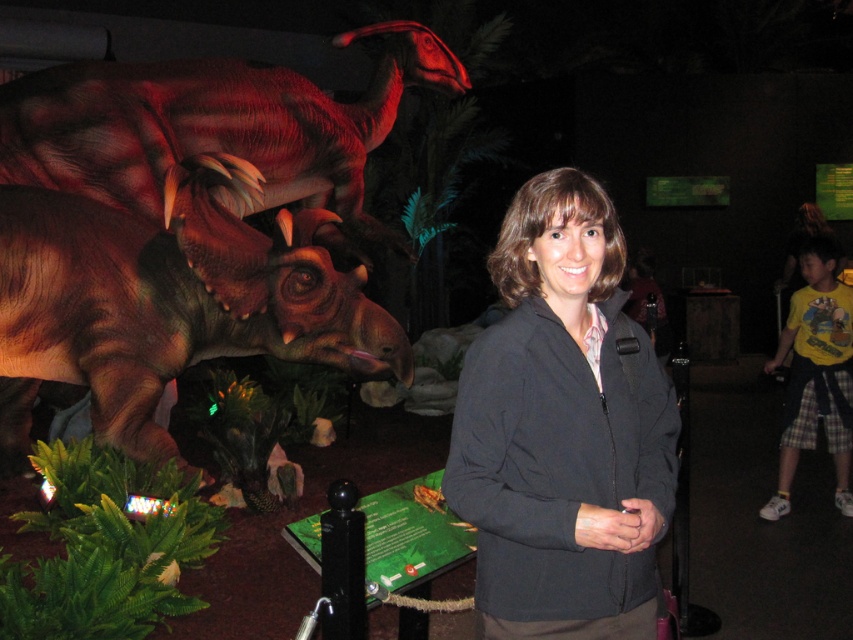
Question: Is brown matte/dull triceratops at left bigger than shiny brown dinosaur at upper left?

Choices:
 (A) no
 (B) yes

Answer: (A)

Question: Among these objects, which one is nearest to the camera?

Choices:
 (A) brown matte/dull triceratops at left
 (B) black fabric jacket at center
 (C) yellow printed t-shirt at right

Answer: (B)

Question: Which of the following is the closest to the observer?

Choices:
 (A) brown matte/dull triceratops at left
 (B) yellow printed t-shirt at right

Answer: (A)

Question: Which object appears closest to the camera in this image?

Choices:
 (A) shiny brown dinosaur at upper left
 (B) brown matte/dull triceratops at left

Answer: (B)

Question: Observing the image, what is the correct spatial positioning of black fabric jacket at center in reference to brown matte/dull triceratops at left?

Choices:
 (A) left
 (B) right

Answer: (B)

Question: In this image, where is brown matte/dull triceratops at left located relative to yellow printed t-shirt at right?

Choices:
 (A) below
 (B) above

Answer: (B)